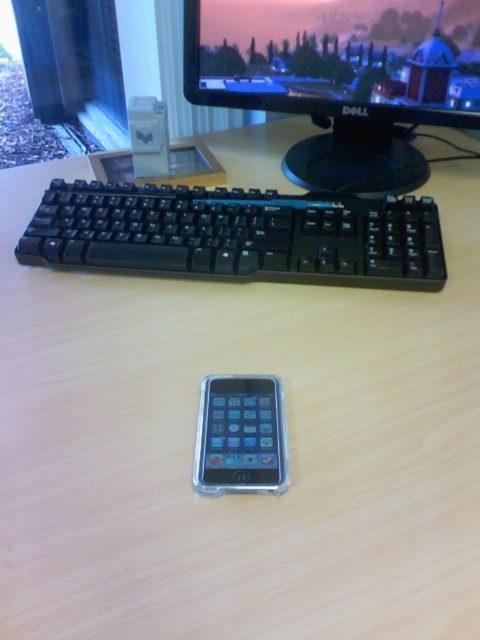
Is point (284, 241) positioned before point (240, 476)?

No, (284, 241) is further to viewer.

Between point (336, 262) and point (247, 483), which one is positioned behind?

Point (336, 262)

Where is `black plastic keyboard at upper center`? black plastic keyboard at upper center is located at coordinates (237, 234).

What do you see at coordinates (339, 77) in the screenshot? This screenshot has width=480, height=640. I see `black plastic monitor at upper center` at bounding box center [339, 77].

Between black plastic monitor at upper center and black plastic keyboard at upper center, which one is positioned lower?

Positioned lower is black plastic keyboard at upper center.

Between point (267, 19) and point (235, 208), which one is positioned in front?

Point (235, 208) is in front.

Find the location of a particular element. black plastic monitor at upper center is located at coordinates (x=339, y=77).

Is point (267, 104) closer to viewer compared to point (235, 490)?

No, it is behind (235, 490).

In the scene shown: Who is higher up, black plastic monitor at upper center or silver metallic smartphone at center?

black plastic monitor at upper center is above.

This screenshot has height=640, width=480. Describe the element at coordinates (339, 77) in the screenshot. I see `black plastic monitor at upper center` at that location.

The height and width of the screenshot is (640, 480). In order to click on black plastic monitor at upper center in this screenshot , I will do `click(339, 77)`.